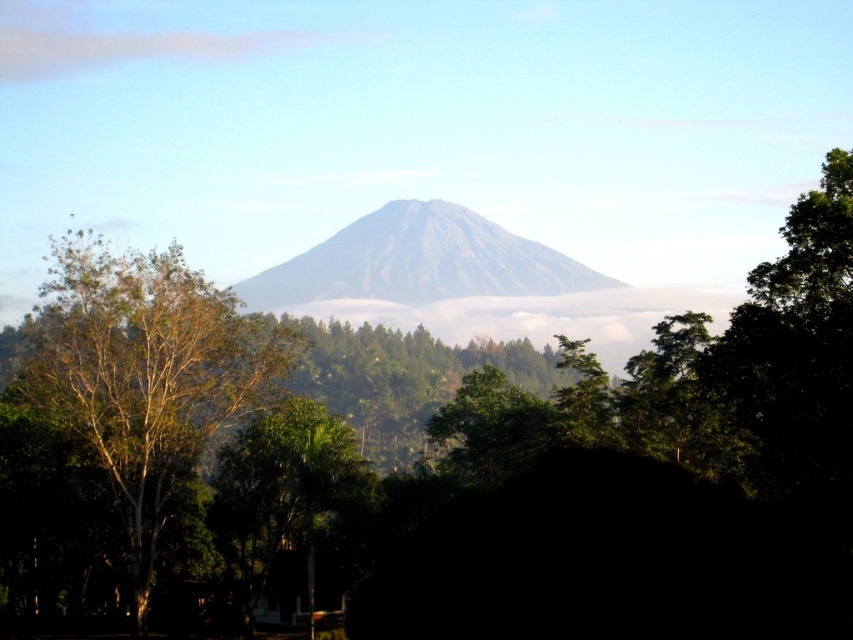
Can you confirm if green leafy tree at center is positioned to the right of green leafy tree at lower center?

Incorrect, green leafy tree at center is not on the right side of green leafy tree at lower center.

Does green leafy tree at center appear on the left side of green leafy tree at lower center?

Correct, you'll find green leafy tree at center to the left of green leafy tree at lower center.

Looking at this image, who is more forward, (x=123, y=352) or (x=231, y=556)?

Positioned in front is point (x=123, y=352).

Image resolution: width=853 pixels, height=640 pixels. Find the location of `green leafy tree at center`. green leafy tree at center is located at coordinates (144, 371).

Which is more to the right, green leafy tree at center or gray matte mountain at center?

Positioned to the right is gray matte mountain at center.

Which of these two, green leafy tree at center or gray matte mountain at center, stands taller?

green leafy tree at center is taller.

The width and height of the screenshot is (853, 640). What are the coordinates of `green leafy tree at center` in the screenshot? It's located at (144, 371).

Can you confirm if gray matte mountain at center is positioned to the right of green leafy tree at lower center?

Yes, gray matte mountain at center is to the right of green leafy tree at lower center.

Between point (486, 225) and point (267, 554), which one is positioned in front?

Positioned in front is point (267, 554).

Between point (521, 244) and point (242, 493), which one is positioned behind?

The point (521, 244) is behind.

This screenshot has width=853, height=640. I want to click on gray matte mountain at center, so click(419, 262).